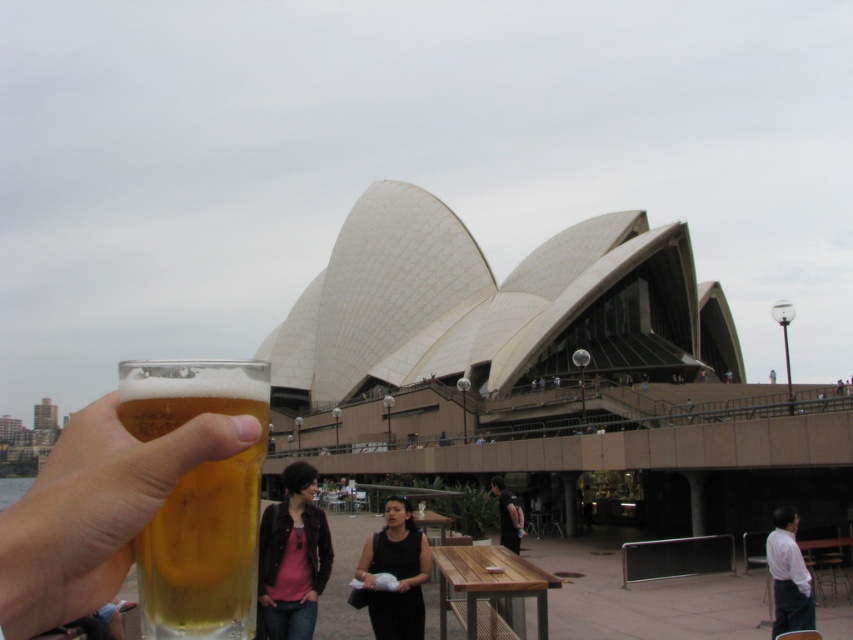
Question: Can you confirm if golden glass beer at lower left is thinner than black fabric dress at center?

Choices:
 (A) no
 (B) yes

Answer: (B)

Question: Which object is the closest to the white shirt at lower right?

Choices:
 (A) black fabric dress at center
 (B) dark gray fabric jacket at center
 (C) golden glass beer at lower left

Answer: (B)

Question: Does black fabric dress at center appear over white shirt at lower right?

Choices:
 (A) no
 (B) yes

Answer: (A)

Question: Which object is closer to the camera taking this photo?

Choices:
 (A) white shirt at lower right
 (B) golden glass beer at lower left
 (C) matte black jacket at center
 (D) dark gray fabric jacket at center

Answer: (B)

Question: Among these points, which one is farthest from the camera?

Choices:
 (A) (506, 528)
 (B) (399, 545)

Answer: (A)

Question: Is matte black jacket at center further to camera compared to dark gray fabric jacket at center?

Choices:
 (A) no
 (B) yes

Answer: (A)